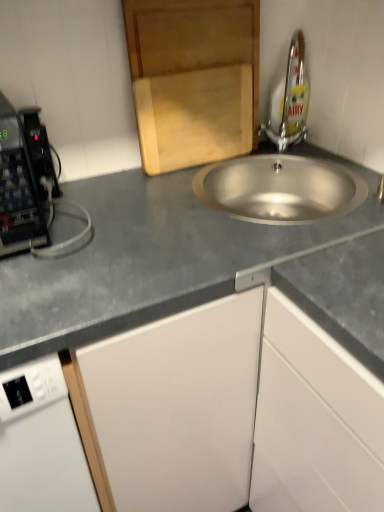
Question: From a real-world perspective, does gray matte countertop at center stand above silver metallic tap at upper right?

Choices:
 (A) yes
 (B) no

Answer: (B)

Question: From the image's perspective, is gray matte countertop at center located beneath silver metallic tap at upper right?

Choices:
 (A) no
 (B) yes

Answer: (B)

Question: Is gray matte countertop at center directly adjacent to silver metallic tap at upper right?

Choices:
 (A) yes
 (B) no

Answer: (B)

Question: Is gray matte countertop at center located outside silver metallic tap at upper right?

Choices:
 (A) yes
 (B) no

Answer: (A)

Question: Is silver metallic tap at upper right inside gray matte countertop at center?

Choices:
 (A) no
 (B) yes

Answer: (A)

Question: Is gray matte countertop at center wider than silver metallic tap at upper right?

Choices:
 (A) no
 (B) yes

Answer: (B)

Question: From a real-world perspective, is white matte cabinet at lower right, the 1th cabinetry from the right, located higher than gray matte countertop at center?

Choices:
 (A) no
 (B) yes

Answer: (A)

Question: Is white matte cabinet at lower right, the 1th cabinetry from the right, outside of gray matte countertop at center?

Choices:
 (A) no
 (B) yes

Answer: (A)

Question: Does white matte cabinet at lower right, the second cabinetry viewed from the top, have a greater height compared to gray matte countertop at center?

Choices:
 (A) no
 (B) yes

Answer: (B)

Question: Can you confirm if white matte cabinet at lower right, the 1th cabinetry from the right, is positioned to the right of gray matte countertop at center?

Choices:
 (A) yes
 (B) no

Answer: (A)

Question: Are white matte cabinet at lower right, the 1th cabinetry from the right, and gray matte countertop at center making contact?

Choices:
 (A) yes
 (B) no

Answer: (B)

Question: From the image's perspective, does white matte cabinet at lower right, the second cabinetry viewed from the top, appear lower than gray matte countertop at center?

Choices:
 (A) no
 (B) yes

Answer: (B)

Question: From a real-world perspective, is wooden cutting board at upper center, arranged as the 2th cabinetry when viewed from the right, physically below silver metallic tap at upper right?

Choices:
 (A) no
 (B) yes

Answer: (A)